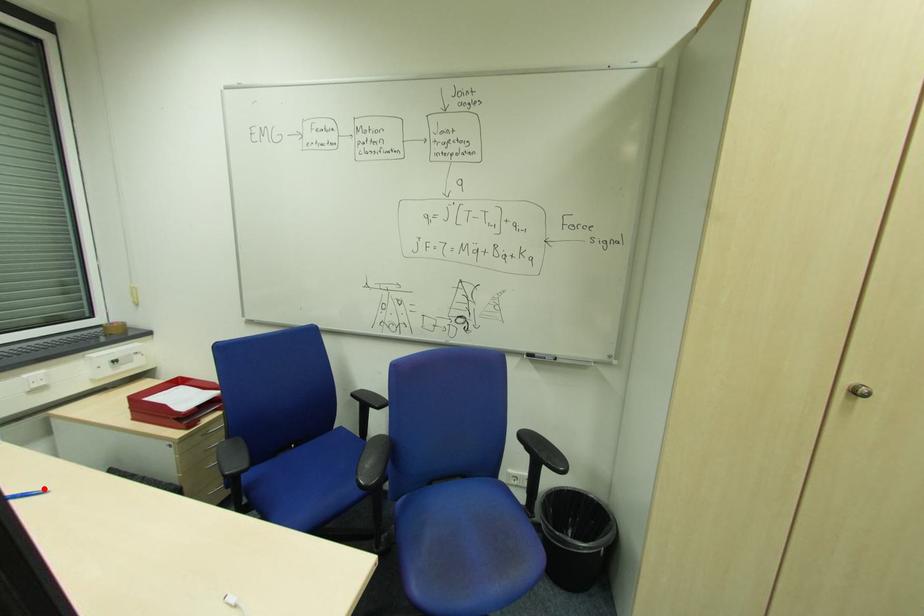
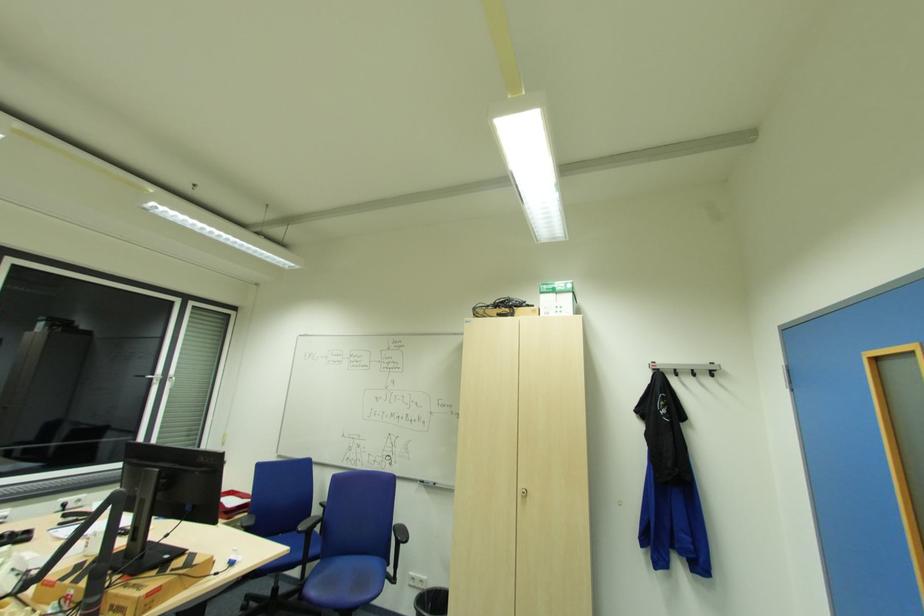
Question: I am providing you with two images of the same scene from different viewpoints. A red point is marked on the first image. At the location where the point appears in image 1, is it still visible in image 2?

Choices:
 (A) Yes
 (B) No

Answer: (B)